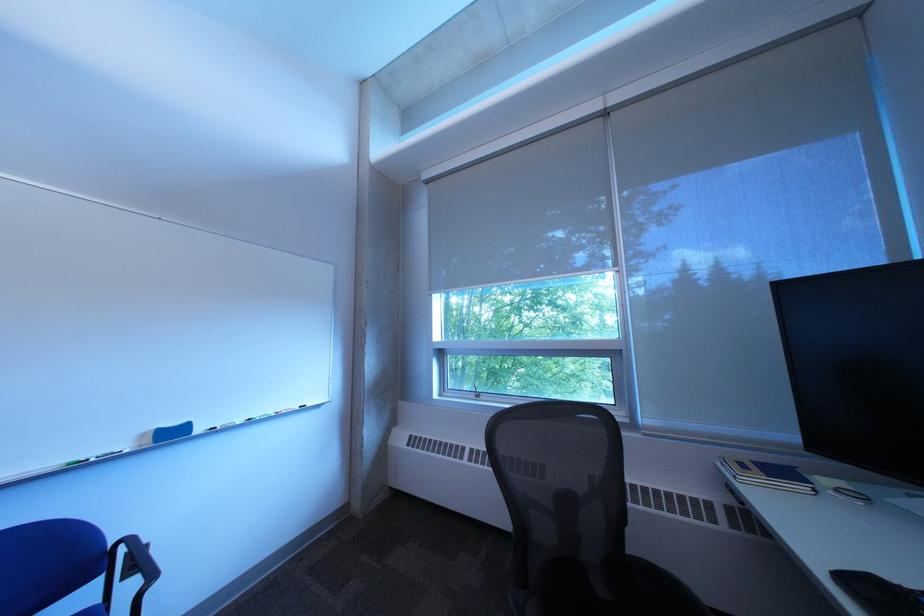
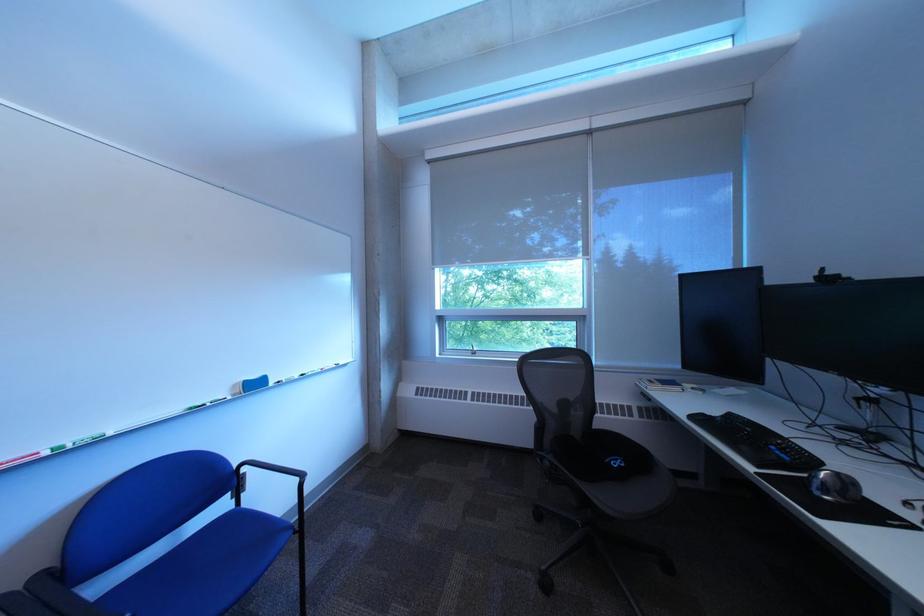
Find the pixel in the second image that matches point (159, 437) in the first image.

(249, 387)